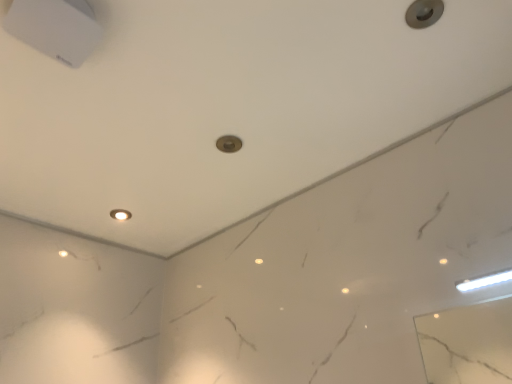
Question: Should I look upward or downward to see matte white light fixture at center?

Choices:
 (A) up
 (B) down

Answer: (B)

Question: From a real-world perspective, is metallic gray knob at upper right positioned over matte white light fixture at center based on gravity?

Choices:
 (A) no
 (B) yes

Answer: (A)

Question: From the image's perspective, is metallic gray knob at upper right above matte white light fixture at center?

Choices:
 (A) yes
 (B) no

Answer: (A)

Question: Is metallic gray knob at upper right to the left of matte white light fixture at center from the viewer's perspective?

Choices:
 (A) yes
 (B) no

Answer: (B)

Question: From the image's perspective, does metallic gray knob at upper right appear lower than matte white light fixture at center?

Choices:
 (A) yes
 (B) no

Answer: (B)

Question: Are metallic gray knob at upper right and matte white light fixture at center far apart?

Choices:
 (A) no
 (B) yes

Answer: (B)

Question: Can you confirm if metallic gray knob at upper right is wider than matte white light fixture at center?

Choices:
 (A) no
 (B) yes

Answer: (A)

Question: Is matte white light fixture at center positioned behind metallic gray knob at upper right?

Choices:
 (A) no
 (B) yes

Answer: (B)

Question: From a real-world perspective, is matte white light fixture at center positioned under metallic gray knob at upper right based on gravity?

Choices:
 (A) yes
 (B) no

Answer: (B)

Question: Can you confirm if matte white light fixture at center is taller than metallic gray knob at upper right?

Choices:
 (A) no
 (B) yes

Answer: (B)

Question: Is matte white light fixture at center to the left of metallic gray knob at upper right from the viewer's perspective?

Choices:
 (A) no
 (B) yes

Answer: (B)

Question: Is matte white light fixture at center positioned in front of metallic gray knob at upper right?

Choices:
 (A) yes
 (B) no

Answer: (B)

Question: From the image's perspective, is matte white light fixture at center on top of metallic gray knob at upper right?

Choices:
 (A) yes
 (B) no

Answer: (B)

Question: From the image's perspective, relative to matte white light fixture at center, is metallic gray knob at upper right above or below?

Choices:
 (A) above
 (B) below

Answer: (A)